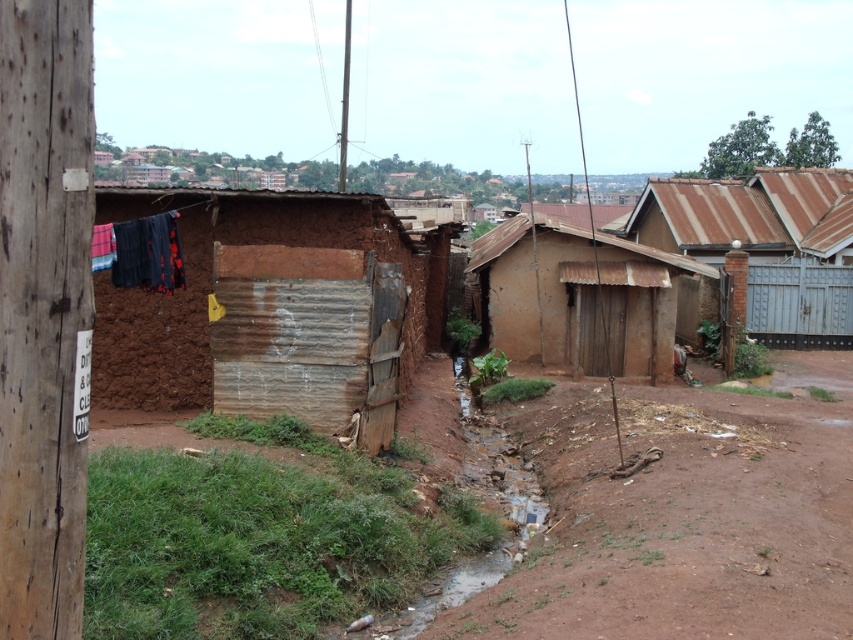
Can you confirm if brown mud hut at center is taller than brushed metal telegraph pole at upper center?

No, brown mud hut at center is not taller than brushed metal telegraph pole at upper center.

Between brown mud hut at center and brushed metal telegraph pole at upper center, which one has less height?

brown mud hut at center

Is point (543, 266) closer to camera compared to point (344, 179)?

Yes, point (543, 266) is in front of point (344, 179).

The height and width of the screenshot is (640, 853). I want to click on brown mud hut at center, so click(578, 298).

Does brown dirt field at center appear under brown corrugated roof at upper right?

Correct, brown dirt field at center is located below brown corrugated roof at upper right.

Is brown dirt field at center to the right of brown corrugated roof at upper right from the viewer's perspective?

No, brown dirt field at center is not to the right of brown corrugated roof at upper right.

The width and height of the screenshot is (853, 640). Find the location of `brown dirt field at center`. brown dirt field at center is located at coordinates (683, 516).

Between brown dirt field at center and brown corrugated metal hut at center, which one appears on the left side from the viewer's perspective?

brown corrugated metal hut at center

Is brown dirt field at center shorter than brown corrugated metal hut at center?

Yes, brown dirt field at center is shorter than brown corrugated metal hut at center.

Find the location of `brown dirt field at center`. brown dirt field at center is located at coordinates (683, 516).